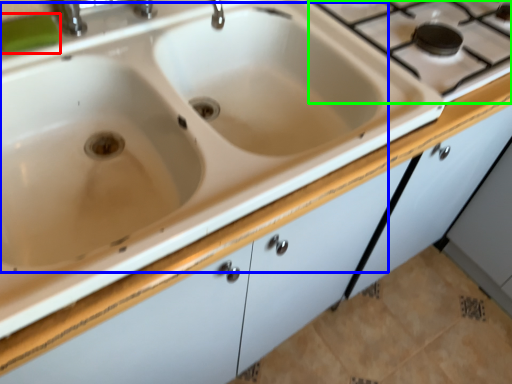
Question: Considering the real-world distances, which object is closest to soap (highlighted by a red box)? sink (highlighted by a blue box) or gas stove (highlighted by a green box).

Choices:
 (A) sink
 (B) gas stove

Answer: (A)